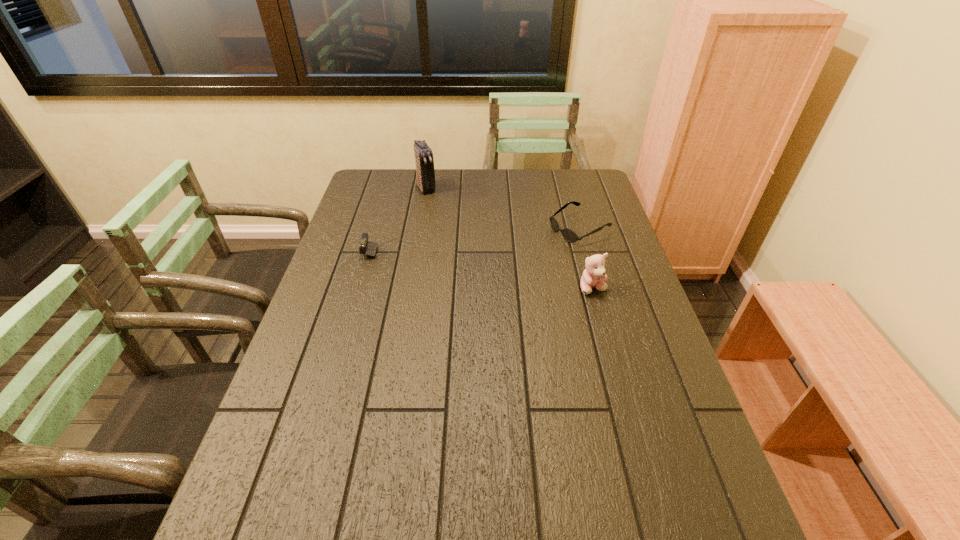
Locate an element on the screen. This screenshot has height=540, width=960. blank area at the near left corner is located at coordinates (290, 501).

Identify the location of free spot between the sunglasses and the nearest object. coord(586,258).

You are a GUI agent. You are given a task and a screenshot of the screen. Output one action in this format:
    pyautogui.click(x=<x>, y=<y>)
    Task: Click on the vacant area that lies between the farthest object and the sunglasses
    
    Given the screenshot: What is the action you would take?
    pyautogui.click(x=503, y=208)

Identify the location of free space between the sunglasses and the nearest object. The width and height of the screenshot is (960, 540). (586, 258).

What are the coordinates of `free space between the webcam and the nearest object` in the screenshot? It's located at (496, 269).

I want to click on free space that is in between the farthest object and the webcam, so click(414, 219).

The image size is (960, 540). I want to click on vacant space that is in between the tallest object and the sunglasses, so click(x=503, y=208).

The image size is (960, 540). What are the coordinates of `free point between the sunglasses and the clutch bag` in the screenshot? It's located at (503, 208).

What are the coordinates of `free space that is in between the sunglasses and the webcam` in the screenshot? It's located at (490, 239).

I want to click on empty location between the webcam and the third shortest object, so click(x=496, y=269).